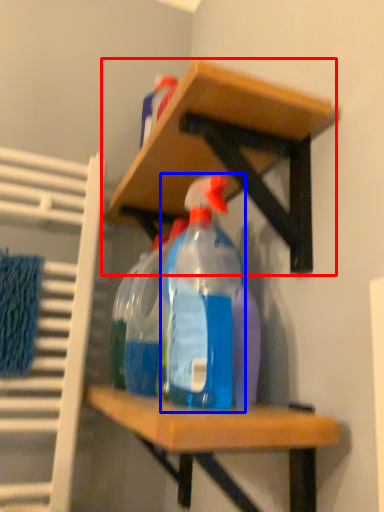
Question: Which object appears closest to the camera in this image, shelf (highlighted by a red box) or bottle (highlighted by a blue box)?

Choices:
 (A) shelf
 (B) bottle

Answer: (A)